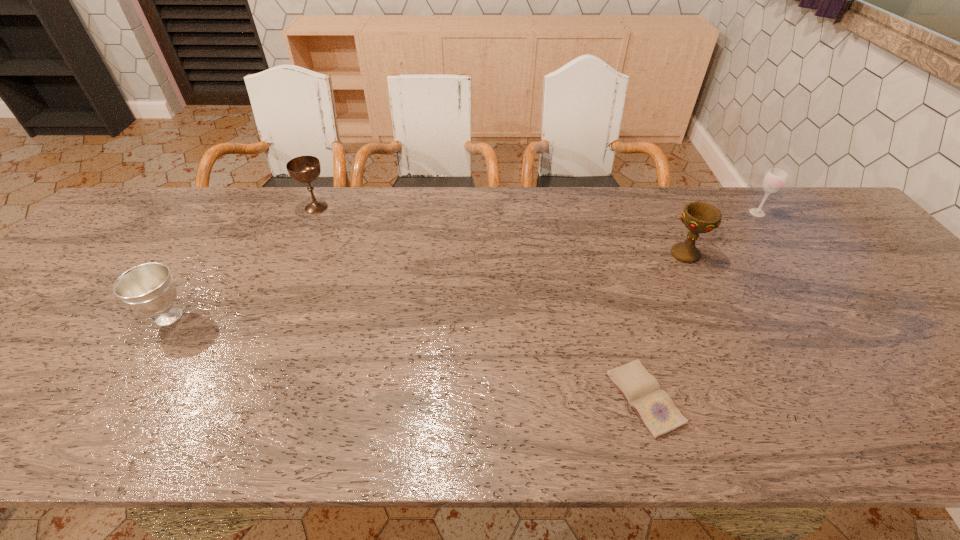
Find the location of a particular element. free point between the nearest object and the wineglass is located at coordinates (701, 306).

Where is `vacant area that lies between the nearest chalice and the wineglass`? This screenshot has height=540, width=960. vacant area that lies between the nearest chalice and the wineglass is located at coordinates (464, 265).

Find the location of a particular element. blank region between the rightmost object and the farthest chalice is located at coordinates [537, 210].

Find the location of a particular element. The width and height of the screenshot is (960, 540). vacant region between the second nearest object and the second chalice from right to left is located at coordinates (243, 262).

Where is `vacant point located between the second object from left to right and the rightmost chalice`? vacant point located between the second object from left to right and the rightmost chalice is located at coordinates (500, 231).

At what (x,y) coordinates should I click in order to perform the action: click on unoccupied area between the rightmost object and the farthest chalice. Please return your answer as a coordinate pair (x, y). Looking at the image, I should click on (537, 210).

You are a GUI agent. You are given a task and a screenshot of the screen. Output one action in this format:
    pyautogui.click(x=<x>, y=<y>)
    Task: Click on the vacant space that is in between the second object from left to right and the wineglass
    Image resolution: width=960 pixels, height=540 pixels.
    Given the screenshot: What is the action you would take?
    pyautogui.click(x=537, y=210)

This screenshot has width=960, height=540. In order to click on vacant region between the fourth farthest object and the third object from left to right in this screenshot , I will do `click(407, 357)`.

Identify the location of vacant area that lies between the leftmost object and the third object from left to right. This screenshot has width=960, height=540. (407, 357).

The height and width of the screenshot is (540, 960). I want to click on vacant point located between the rightmost object and the leftmost object, so click(464, 265).